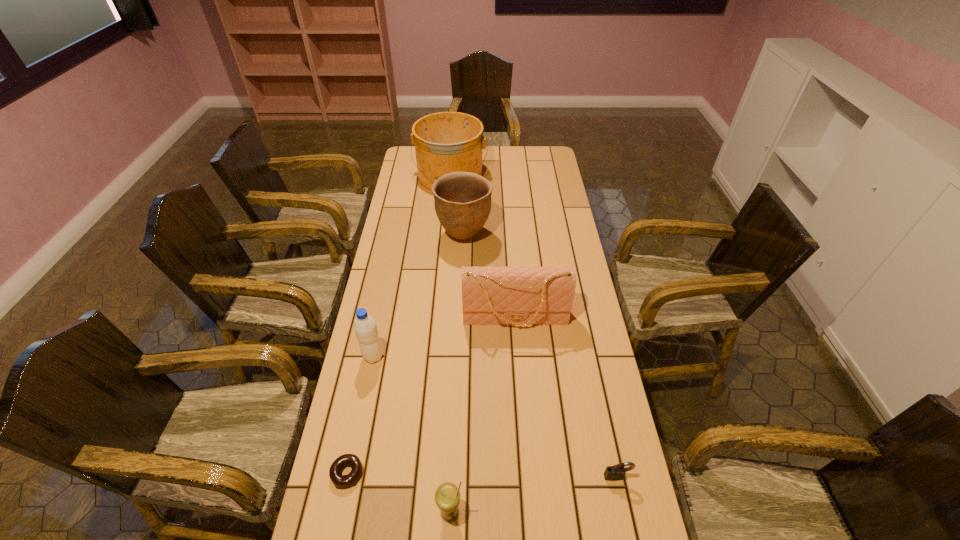
I want to click on the farthest object, so click(445, 142).

I want to click on the sixth nearest object, so click(462, 200).

At what (x,y) coordinates should I click in order to perform the action: click on the fifth nearest object. Please return your answer as a coordinate pair (x, y). The image size is (960, 540). Looking at the image, I should click on (504, 295).

Where is `water bottle`? This screenshot has height=540, width=960. water bottle is located at coordinates (365, 327).

At what (x,y) coordinates should I click in order to perform the action: click on straw for drinking. Please return your answer as a coordinate pair (x, y). The image size is (960, 540). Looking at the image, I should click on (447, 497).

You are a GUI agent. You are given a task and a screenshot of the screen. Output one action in this format:
    pyautogui.click(x=<x>, y=<y>)
    Task: Click on the third shortest object
    This screenshot has height=540, width=960.
    Given the screenshot: What is the action you would take?
    pyautogui.click(x=447, y=497)

What are the coordinates of `the sixth tallest object` in the screenshot? It's located at (616, 472).

Identify the location of padlock. (616, 472).

Locate an element on the screen. The image size is (960, 540). doughnut is located at coordinates (342, 481).

Find the location of a particular element. This screenshot has height=540, width=960. vacant region located 0.260m on the front of the bucket is located at coordinates (445, 233).